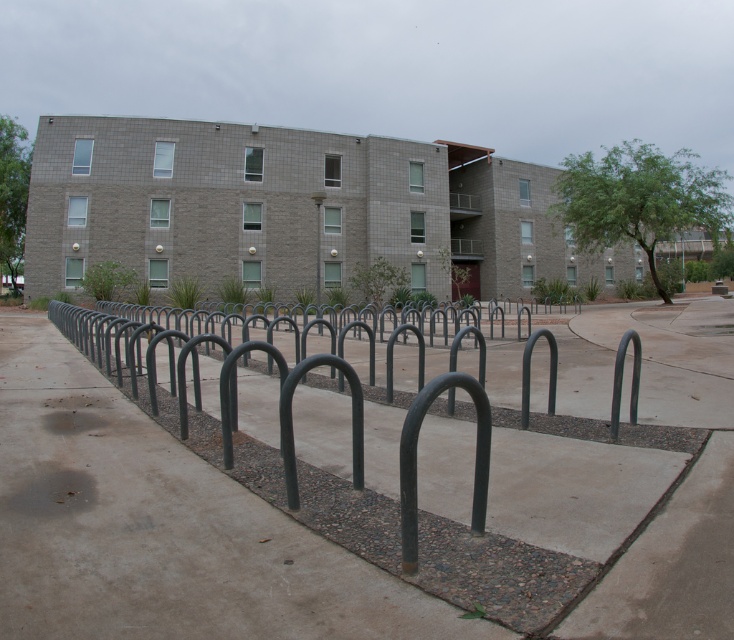
Is gray concrete pavement at center closer to the viewer compared to metallic pole at center?

Yes, gray concrete pavement at center is closer to the viewer.

The image size is (734, 640). Identify the location of gray concrete pavement at center. [159, 528].

Describe the element at coordinates (159, 528) in the screenshot. I see `gray concrete pavement at center` at that location.

Image resolution: width=734 pixels, height=640 pixels. Identify the location of gray concrete pavement at center. [159, 528].